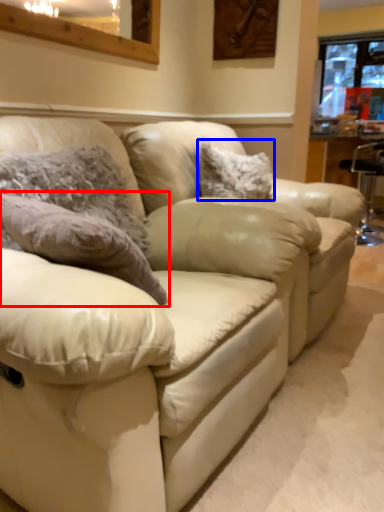
Question: Which object appears farthest to the camera in this image, pillow (highlighted by a red box) or pillow (highlighted by a blue box)?

Choices:
 (A) pillow
 (B) pillow

Answer: (B)